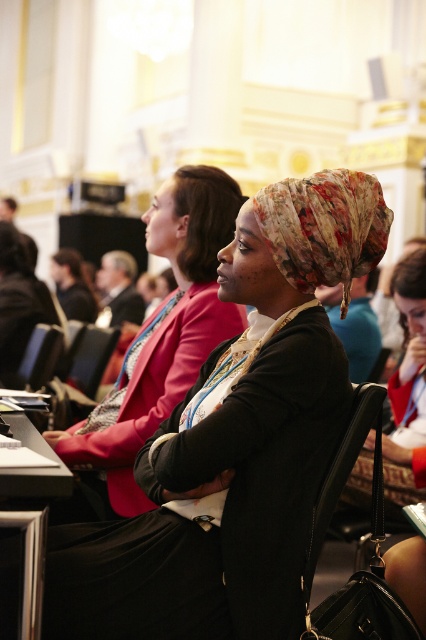
Question: Can you confirm if floral-patterned headscarf at center is thinner than black leather chair at center?

Choices:
 (A) no
 (B) yes

Answer: (A)

Question: Is floral-patterned headscarf at center below floral fabric headscarf at center?

Choices:
 (A) no
 (B) yes

Answer: (B)

Question: Which point is farther to the camera?

Choices:
 (A) (328, 186)
 (B) (86, 435)

Answer: (B)

Question: Is floral fabric headscarf at center to the right of black leather chair at center from the viewer's perspective?

Choices:
 (A) yes
 (B) no

Answer: (A)

Question: Which point appears farthest from the camera in this image?

Choices:
 (A) tap(80, 388)
 (B) tap(210, 218)

Answer: (A)

Question: Which object is farther from the camera taking this photo?

Choices:
 (A) floral-patterned headscarf at center
 (B) floral fabric headscarf at center

Answer: (B)